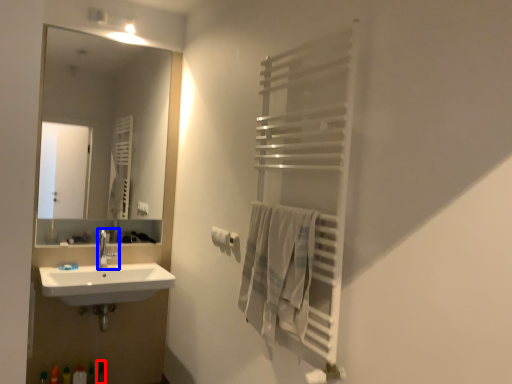
Question: Which of the following is the closest to the observer, toiletry (highlighted by a red box) or tap (highlighted by a blue box)?

Choices:
 (A) toiletry
 (B) tap

Answer: (A)